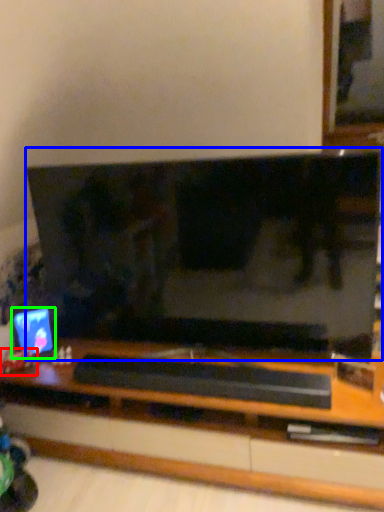
Question: Which object is positioned closest to toy (highlighted by a red box)? Select from television (highlighted by a blue box) and computer monitor (highlighted by a green box).

Choices:
 (A) television
 (B) computer monitor

Answer: (B)